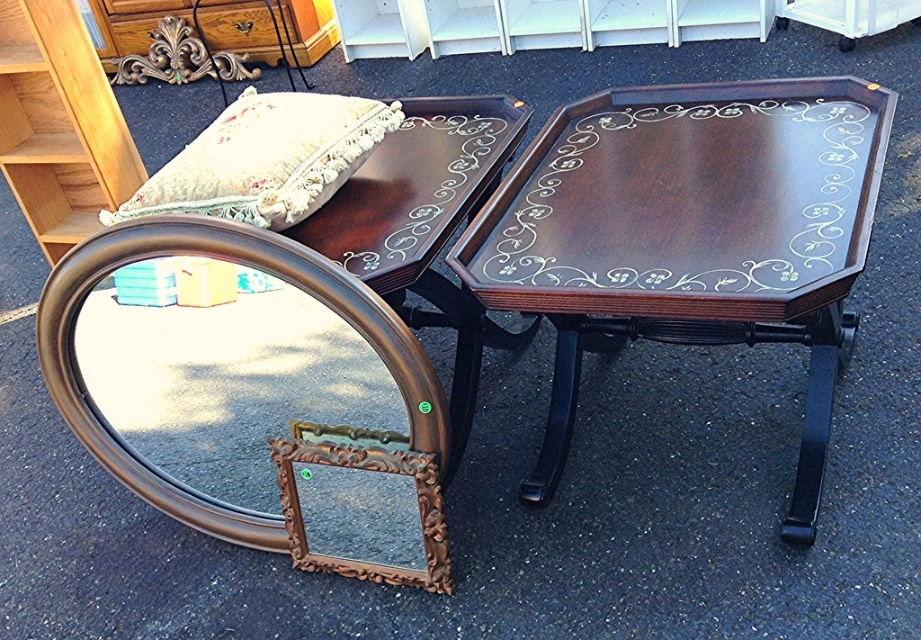
You are setting up a display for a vintage shop and need to arrange the gold ornate mirror at center and the velvet floral pillow at upper left. According to the scene, where should each item be placed relative to the other?

The gold ornate mirror at center should be placed below the velvet floral pillow at upper left, as it is located below it in the scene.